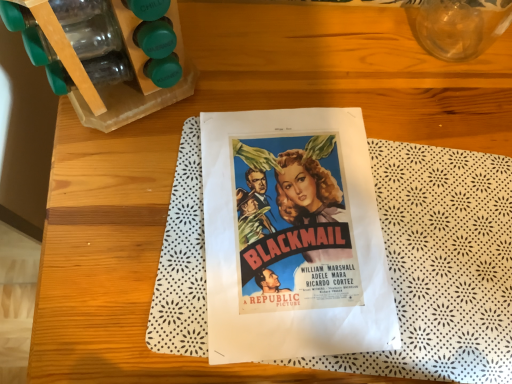
Question: From a real-world perspective, is vivid paper poster at center positioned under transparent glass vase at upper right based on gravity?

Choices:
 (A) no
 (B) yes

Answer: (B)

Question: From the image's perspective, is vivid paper poster at center under transparent glass vase at upper right?

Choices:
 (A) yes
 (B) no

Answer: (A)

Question: Is vivid paper poster at center thinner than transparent glass vase at upper right?

Choices:
 (A) no
 (B) yes

Answer: (A)

Question: Can you confirm if vivid paper poster at center is taller than transparent glass vase at upper right?

Choices:
 (A) yes
 (B) no

Answer: (B)

Question: Is transparent glass vase at upper right inside vivid paper poster at center?

Choices:
 (A) yes
 (B) no

Answer: (B)

Question: Are vivid paper poster at center and transparent glass vase at upper right located far from each other?

Choices:
 (A) no
 (B) yes

Answer: (A)

Question: Can you confirm if transparent glass vase at upper right is wider than vivid paper poster at center?

Choices:
 (A) no
 (B) yes

Answer: (A)

Question: Is transparent glass vase at upper right facing away from vivid paper poster at center?

Choices:
 (A) yes
 (B) no

Answer: (B)

Question: Is transparent glass vase at upper right positioned in front of vivid paper poster at center?

Choices:
 (A) no
 (B) yes

Answer: (B)

Question: Are transparent glass vase at upper right and vivid paper poster at center located far from each other?

Choices:
 (A) no
 (B) yes

Answer: (A)

Question: From the image's perspective, does transparent glass vase at upper right appear higher than vivid paper poster at center?

Choices:
 (A) yes
 (B) no

Answer: (A)

Question: Is transparent glass vase at upper right further to camera compared to vivid paper poster at center?

Choices:
 (A) no
 (B) yes

Answer: (A)

Question: Relative to vivid paper poster at center, is transparent glass vase at upper right in front or behind?

Choices:
 (A) front
 (B) behind

Answer: (A)